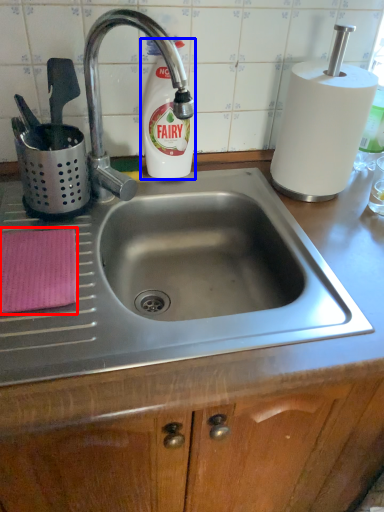
Question: Among these objects, which one is nearest to the camera, cloth (highlighted by a red box) or cleaning product (highlighted by a blue box)?

Choices:
 (A) cloth
 (B) cleaning product

Answer: (A)